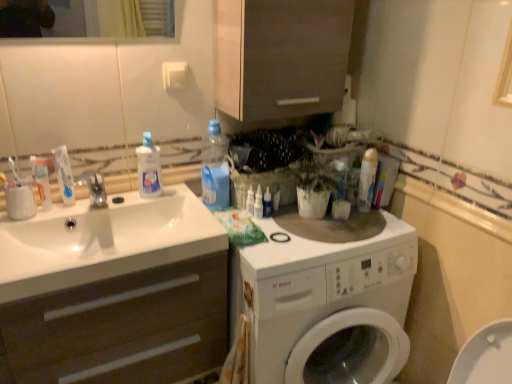
Question: Is white matte cabinet at left surrounding white glossy sink at left?

Choices:
 (A) no
 (B) yes

Answer: (B)

Question: Is white matte cabinet at left shorter than white glossy sink at left?

Choices:
 (A) yes
 (B) no

Answer: (B)

Question: Is white matte cabinet at left far from white glossy sink at left?

Choices:
 (A) no
 (B) yes

Answer: (A)

Question: Does white matte cabinet at left appear on the left side of white glossy sink at left?

Choices:
 (A) no
 (B) yes

Answer: (B)

Question: Can you confirm if white matte cabinet at left is wider than white glossy sink at left?

Choices:
 (A) yes
 (B) no

Answer: (B)

Question: Does white matte cabinet at left have a lesser width compared to white glossy sink at left?

Choices:
 (A) yes
 (B) no

Answer: (A)

Question: From the image's perspective, would you say white glossy toothpaste at left, which appears as the second toothpaste when viewed from the left, is positioned over transparent plastic spray bottle at center, the 2th cleaning product when ordered from right to left?

Choices:
 (A) no
 (B) yes

Answer: (B)

Question: Is white glossy toothpaste at left, which appears as the second toothpaste when viewed from the left, to the right of transparent plastic spray bottle at center, the 2th cleaning product when ordered from right to left, from the viewer's perspective?

Choices:
 (A) yes
 (B) no

Answer: (B)

Question: Is white glossy toothpaste at left, which appears as the second toothpaste when viewed from the left, not within transparent plastic spray bottle at center, which appears as the 3th cleaning product when viewed from the left?

Choices:
 (A) no
 (B) yes

Answer: (B)

Question: Does white glossy toothpaste at left, which appears as the second toothpaste when viewed from the left, lie behind transparent plastic spray bottle at center, the 2th cleaning product when ordered from right to left?

Choices:
 (A) yes
 (B) no

Answer: (B)

Question: Is white glossy toothpaste at left, which appears as the second toothpaste when viewed from the left, looking in the opposite direction of transparent plastic spray bottle at center, the 2th cleaning product when ordered from right to left?

Choices:
 (A) yes
 (B) no

Answer: (B)

Question: Is white glossy toothpaste at left, which appears as the second toothpaste when viewed from the left, in contact with transparent plastic spray bottle at center, which appears as the 3th cleaning product when viewed from the left?

Choices:
 (A) no
 (B) yes

Answer: (A)

Question: Is white glossy bottle at center, which ranks as the first toiletry in right-to-left order, closer to the viewer compared to transparent plastic spray bottle at center, which appears as the 3th cleaning product when viewed from the left?

Choices:
 (A) no
 (B) yes

Answer: (A)